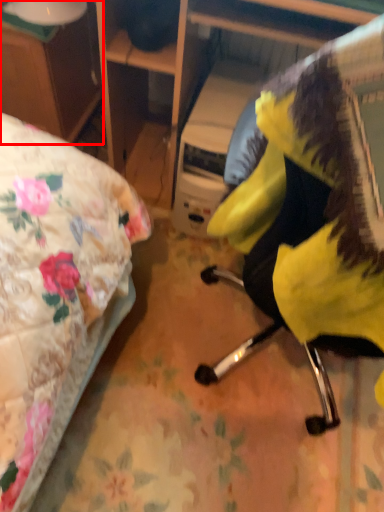
Question: Observing the image, what is the correct spatial positioning of desk (annotated by the red box) in reference to chair?

Choices:
 (A) right
 (B) left

Answer: (B)